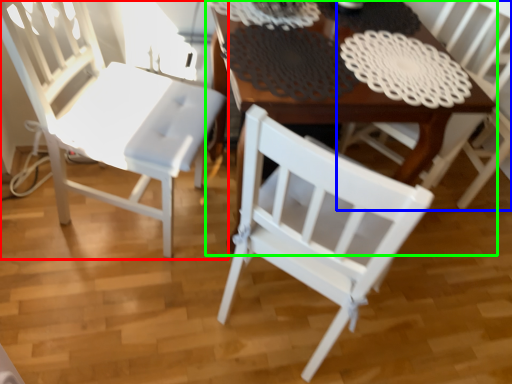
Question: Estimate the real-world distances between objects in this image. Which object is closer to chair (highlighted by a red box), chair (highlighted by a blue box) or table (highlighted by a green box)?

Choices:
 (A) chair
 (B) table

Answer: (B)